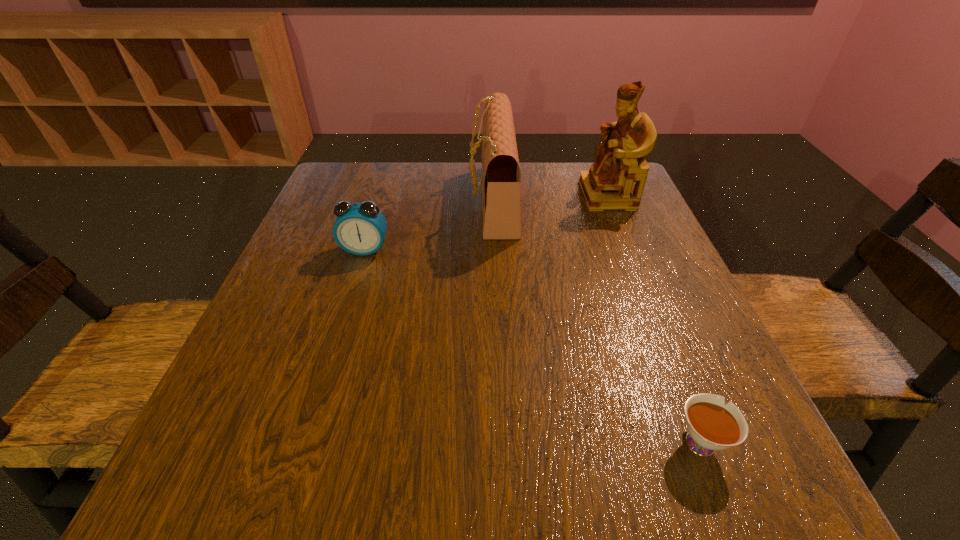
Where is `figurine`? The height and width of the screenshot is (540, 960). figurine is located at coordinates (620, 161).

The width and height of the screenshot is (960, 540). What are the coordinates of `handbag` in the screenshot? It's located at (501, 178).

Image resolution: width=960 pixels, height=540 pixels. I want to click on the third object from right to left, so click(x=501, y=178).

Locate an element on the screen. the second shortest object is located at coordinates (360, 228).

Locate an element on the screen. The image size is (960, 540). the leftmost object is located at coordinates (360, 228).

The width and height of the screenshot is (960, 540). Find the location of `teacup`. teacup is located at coordinates (712, 425).

I want to click on the shortest object, so click(x=712, y=425).

The height and width of the screenshot is (540, 960). What are the coordinates of `free space located on the front-facing side of the figurine` in the screenshot? It's located at [559, 195].

Locate an element on the screen. This screenshot has height=540, width=960. free location located on the front-facing side of the figurine is located at coordinates (510, 195).

Locate an element on the screen. The width and height of the screenshot is (960, 540). free space located on the front-facing side of the figurine is located at coordinates (469, 195).